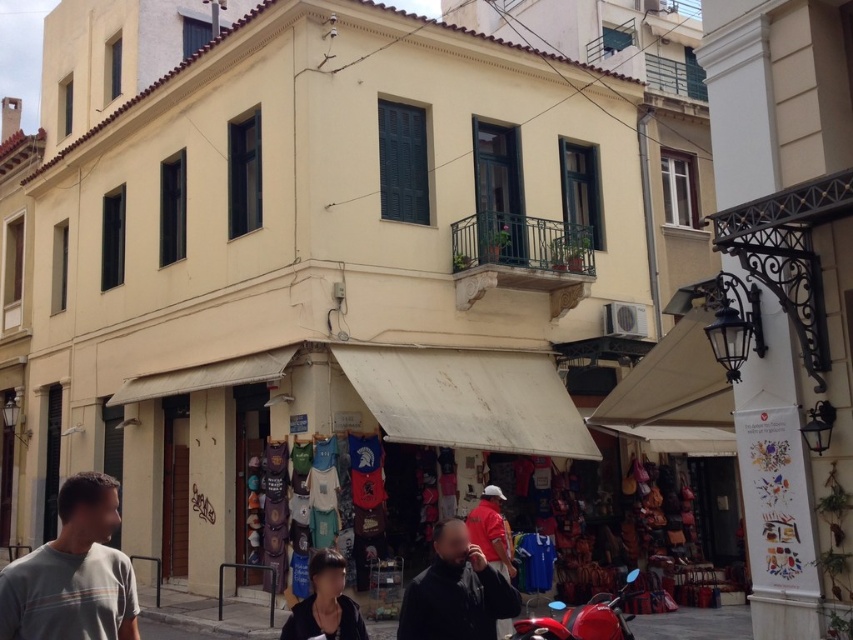
Question: Which of the following is the closest to the observer?

Choices:
 (A) gray striped shirt at lower left
 (B) shiny red motorcycle at lower right
 (C) dark blue fabric at center
 (D) red cotton shirt at center

Answer: (A)

Question: Can you confirm if gray striped shirt at lower left is positioned above dark blue fabric at center?

Choices:
 (A) yes
 (B) no

Answer: (A)

Question: Which point is closer to the camera?

Choices:
 (A) shiny red motorcycle at lower right
 (B) gray striped shirt at lower left
 (C) red cotton shirt at center

Answer: (B)

Question: Considering the relative positions of gray striped shirt at lower left and dark blue fabric at center in the image provided, where is gray striped shirt at lower left located with respect to dark blue fabric at center?

Choices:
 (A) above
 (B) below

Answer: (A)

Question: Which point is farther from the camera taking this photo?

Choices:
 (A) (471, 525)
 (B) (616, 595)

Answer: (B)

Question: Does dark blue fabric at center appear on the right side of shiny red motorcycle at lower right?

Choices:
 (A) yes
 (B) no

Answer: (B)